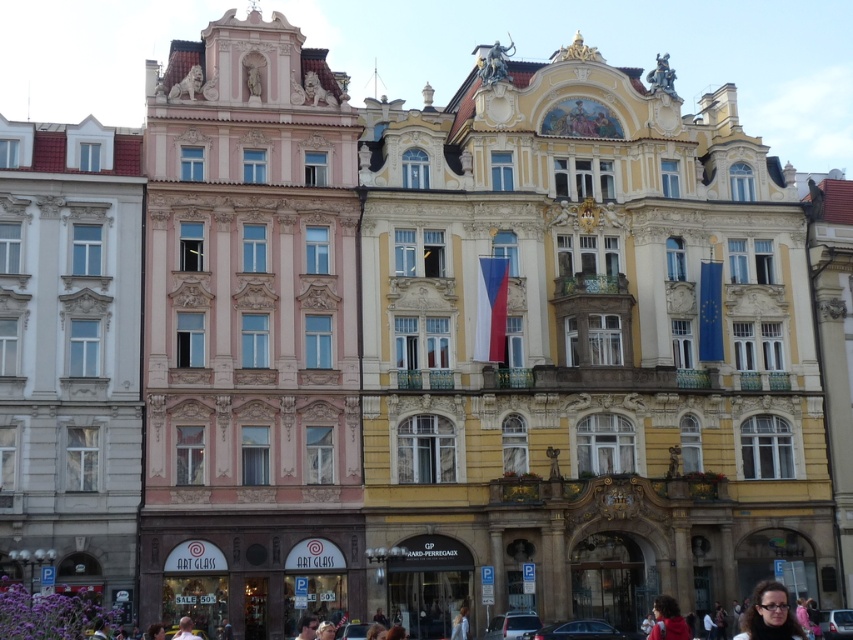
You are standing at the center of the street in front of the row of buildings. Which building is closer to the point marked at coordinates (70,356)?

The white stone building at left is located at point (70,356), so it is the closest to that coordinate.

You are a tourist standing in front of the white stone building at left and the light brown hair at lower center. Which object is closer to you?

The white stone building at left is closer to you because the light brown hair at lower center is behind it.

You are a tourist standing in front of the white stone building at left and the light brown hair at lower center. Which object is located to the right of the other?

The light brown hair at lower center is located to the right of the white stone building at left.